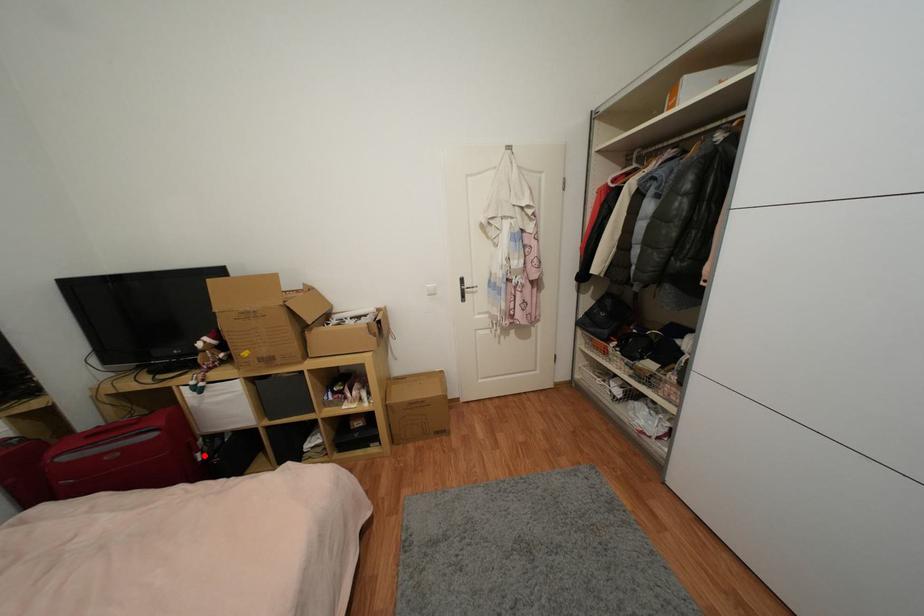
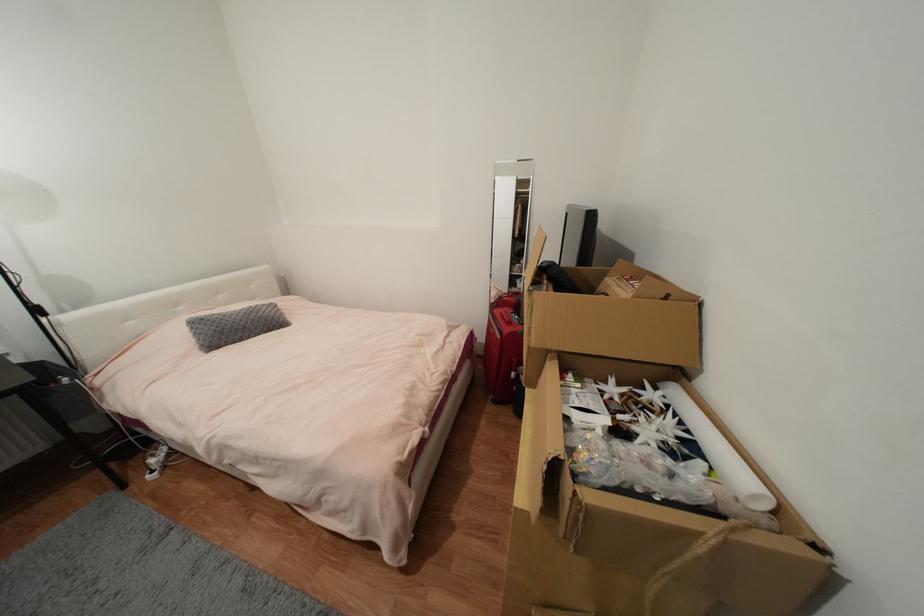
Question: I am providing you with two images of the same scene from different viewpoints. Image1 has a red point marked. In image2, the corresponding 3D location appears at what relative position? Reply with the corresponding letter.

Choices:
 (A) Closer
 (B) Farther

Answer: (B)